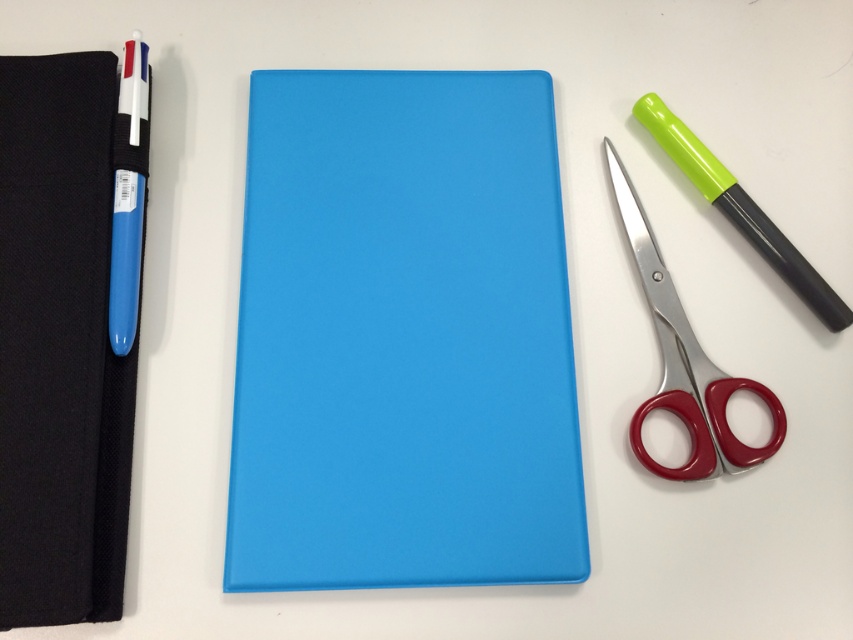
Question: Which object is the farthest from the red plastic scissors at right?

Choices:
 (A) matte blue notebook at center
 (B) green matte pen at right
 (C) black fabric notebook at left

Answer: (C)

Question: Is green matte pen at right behind matte plastic pen at left?

Choices:
 (A) yes
 (B) no

Answer: (A)

Question: Is matte blue notebook at center above black fabric notebook at left?

Choices:
 (A) no
 (B) yes

Answer: (B)

Question: Among these objects, which one is farthest from the camera?

Choices:
 (A) matte blue notebook at center
 (B) green matte pen at right
 (C) black fabric notebook at left

Answer: (B)

Question: Estimate the real-world distances between objects in this image. Which object is closer to the matte blue notebook at center?

Choices:
 (A) matte plastic pen at left
 (B) black fabric notebook at left
 (C) green matte pen at right

Answer: (B)

Question: Is matte blue notebook at center to the left of red plastic scissors at right from the viewer's perspective?

Choices:
 (A) yes
 (B) no

Answer: (A)